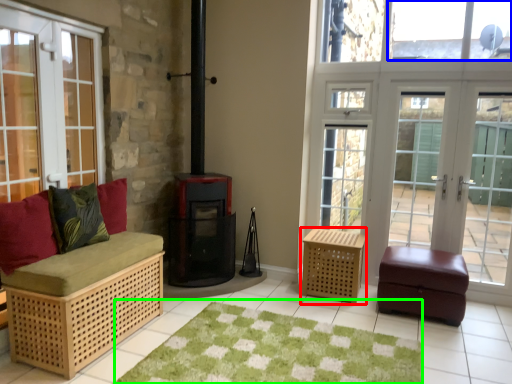
Question: Based on their relative distances, which object is farther from furniture (highlighted by a red box)? Choose from window screen (highlighted by a blue box) and mat (highlighted by a green box).

Choices:
 (A) window screen
 (B) mat

Answer: (A)